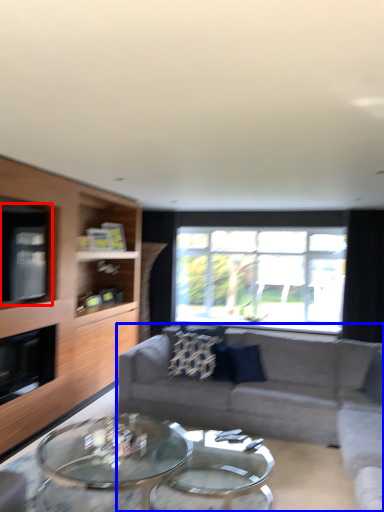
Question: Which object appears farthest to the camera in this image, window screen (highlighted by a red box) or studio couch (highlighted by a blue box)?

Choices:
 (A) window screen
 (B) studio couch

Answer: (A)